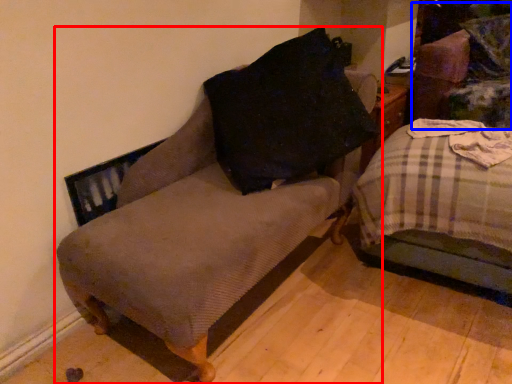
Question: Which object is closer to the camera taking this photo, furniture (highlighted by a red box) or swivel chair (highlighted by a blue box)?

Choices:
 (A) furniture
 (B) swivel chair

Answer: (A)